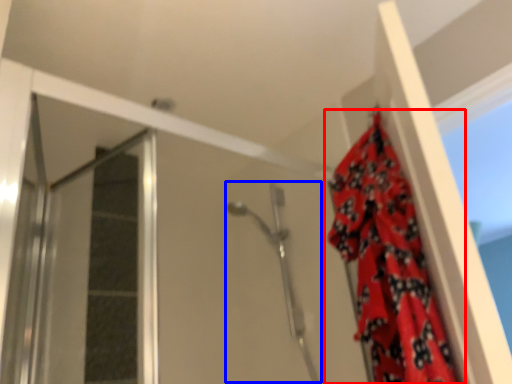
Question: Which object appears farthest to the camera in this image, curtain (highlighted by a red box) or shower (highlighted by a blue box)?

Choices:
 (A) curtain
 (B) shower

Answer: (B)